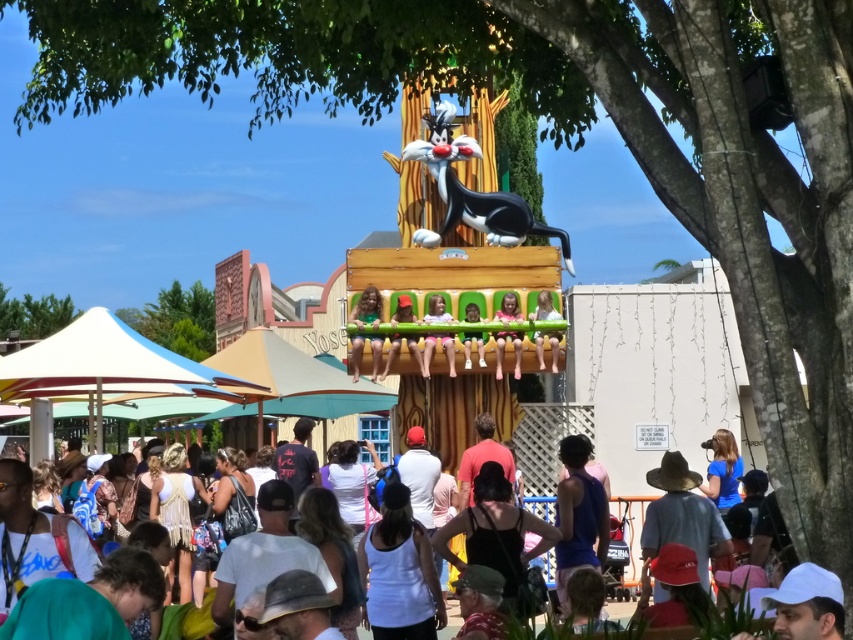
Question: Is the position of green fabric chair at center less distant than that of white cotton crowd at lower center?

Choices:
 (A) yes
 (B) no

Answer: (B)

Question: Which point appears farthest from the camera in this image?

Choices:
 (A) (457, 310)
 (B) (502, 296)
 (C) (364, 336)

Answer: (B)

Question: Can you confirm if pastel plastic seats at center is positioned to the left of matte pink dress at center?

Choices:
 (A) yes
 (B) no

Answer: (A)

Question: Which of these objects is positioned farthest from the white cotton crowd at lower center?

Choices:
 (A) matte pink dress at center
 (B) green fabric chair at center

Answer: (B)

Question: Is pastel plastic seats at center closer to the viewer compared to white cotton crowd at lower center?

Choices:
 (A) yes
 (B) no

Answer: (B)

Question: Among these points, which one is farthest from the camera?

Choices:
 (A) (535, 364)
 (B) (515, 358)
 (C) (706, 582)

Answer: (A)